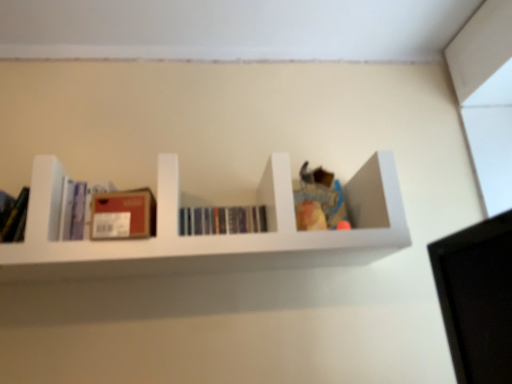
Question: From a real-world perspective, is matte cardboard box at center left above or below matte purple book at left, the 1th book in the left-to-right sequence?

Choices:
 (A) below
 (B) above

Answer: (A)

Question: Considering the positions of matte cardboard box at center left and matte purple book at left, which is the second book in right-to-left order, in the image, is matte cardboard box at center left taller or shorter than matte purple book at left, which is the second book in right-to-left order,?

Choices:
 (A) tall
 (B) short

Answer: (B)

Question: Which is farther from the hardcover books at center, the 2th book when ordered from left to right?

Choices:
 (A) matte cardboard box at center left
 (B) matte purple book at left, the 1th book in the left-to-right sequence
 (C) white matte shelf at center

Answer: (B)

Question: Estimate the real-world distances between objects in this image. Which object is farther from the matte purple book at left, the 1th book in the left-to-right sequence?

Choices:
 (A) matte cardboard box at center left
 (B) hardcover books at center, the 2th book when ordered from left to right
 (C) white matte shelf at center

Answer: (C)